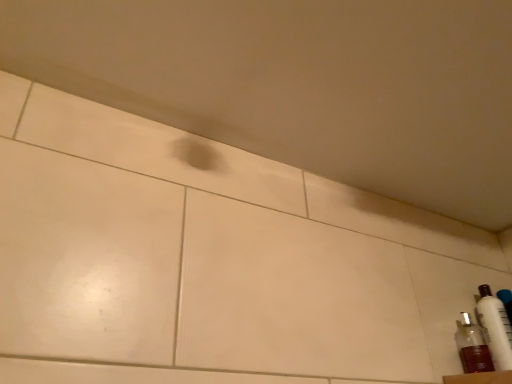
Question: In terms of width, does translucent plastic bottle at lower right, which is counted as the first bottle, starting from the left, look wider or thinner when compared to white glossy bottle at lower right, placed as the 2th bottle when sorted from left to right?

Choices:
 (A) wide
 (B) thin

Answer: (A)

Question: Is translucent plastic bottle at lower right, the 2th bottle viewed from the right, bigger or smaller than white glossy bottle at lower right, placed as the 2th bottle when sorted from left to right?

Choices:
 (A) small
 (B) big

Answer: (B)

Question: Based on their positions, is translucent plastic bottle at lower right, which is counted as the first bottle, starting from the left, located to the left or right of white glossy bottle at lower right, which ranks as the first bottle in right-to-left order?

Choices:
 (A) left
 (B) right

Answer: (A)

Question: From a real-world perspective, is white glossy bottle at lower right, placed as the 2th bottle when sorted from left to right, physically located above or below translucent plastic bottle at lower right, which is counted as the first bottle, starting from the left?

Choices:
 (A) above
 (B) below

Answer: (A)

Question: Is white glossy bottle at lower right, placed as the 2th bottle when sorted from left to right, in front of or behind translucent plastic bottle at lower right, the 2th bottle viewed from the right, in the image?

Choices:
 (A) behind
 (B) front

Answer: (A)

Question: Is white glossy bottle at lower right, which ranks as the first bottle in right-to-left order, taller or shorter than translucent plastic bottle at lower right, which is counted as the first bottle, starting from the left?

Choices:
 (A) tall
 (B) short

Answer: (A)

Question: Is white glossy bottle at lower right, placed as the 2th bottle when sorted from left to right, bigger or smaller than translucent plastic bottle at lower right, the 2th bottle viewed from the right?

Choices:
 (A) big
 (B) small

Answer: (B)